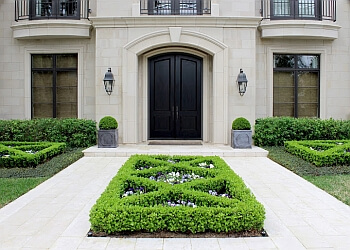
Locate an element on the screen. right door handle is located at coordinates (177, 113).